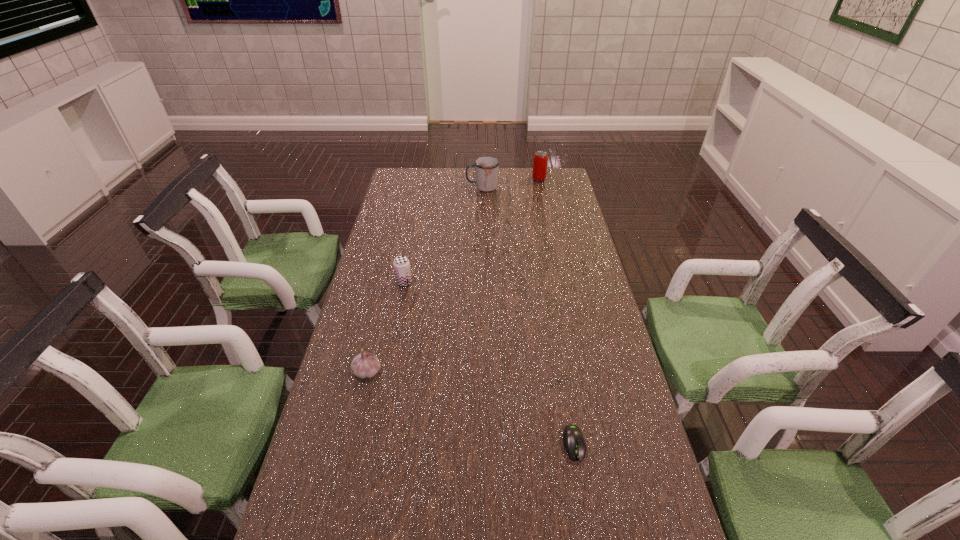
Locate an element on the screen. the taller beer can is located at coordinates (539, 172).

The width and height of the screenshot is (960, 540). I want to click on the right beer can, so click(539, 172).

The image size is (960, 540). I want to click on mug, so click(x=486, y=168).

Where is `the left beer can`? This screenshot has height=540, width=960. the left beer can is located at coordinates (401, 264).

Find the location of a particular element. This screenshot has height=540, width=960. the third nearest object is located at coordinates (401, 264).

In order to click on the fourth farthest object in this screenshot , I will do `click(365, 365)`.

Find the location of a particular element. The width and height of the screenshot is (960, 540). the shortest object is located at coordinates (573, 439).

The image size is (960, 540). I want to click on the nearest object, so click(573, 439).

Where is `vacant space located on the front of the right beer can`? The image size is (960, 540). vacant space located on the front of the right beer can is located at coordinates (547, 217).

Identify the location of free space located 0.280m on the handle side of the mug. The width and height of the screenshot is (960, 540). (404, 187).